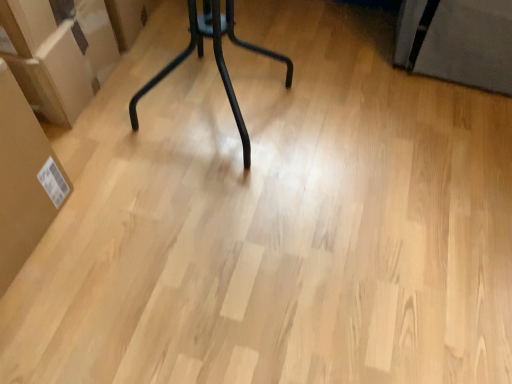
Image resolution: width=512 pixels, height=384 pixels. Find the location of `free spot behind brown cardboard box at left, which ranks as the 2th cardboard box in top-to-bottom order`. free spot behind brown cardboard box at left, which ranks as the 2th cardboard box in top-to-bottom order is located at coordinates (93, 150).